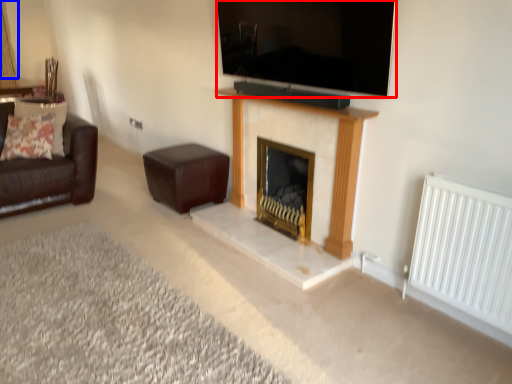
Question: Which point is closer to the camera, television (highlighted by a red box) or curtain (highlighted by a blue box)?

Choices:
 (A) television
 (B) curtain

Answer: (A)